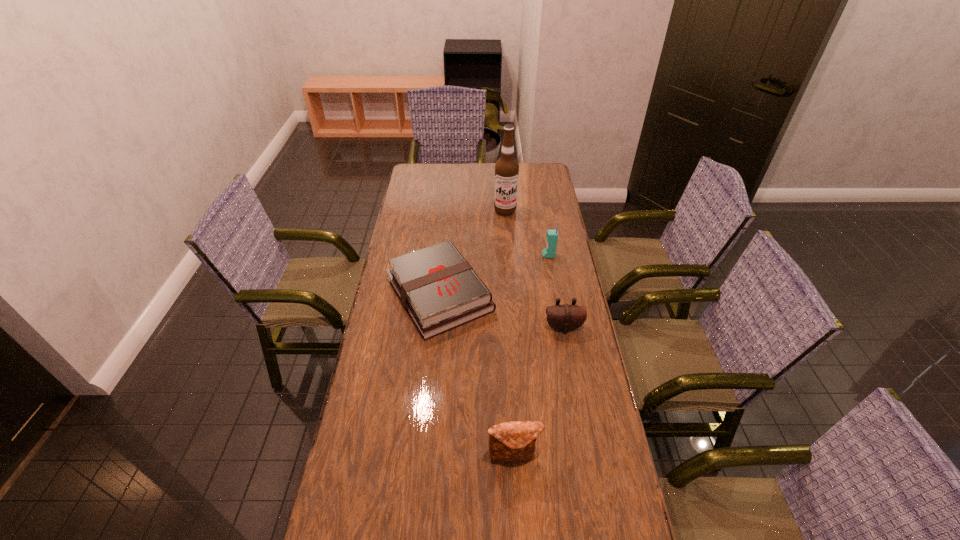
In the image, there is a desktop. Identify the location of blank space at the far right corner. The height and width of the screenshot is (540, 960). [x=548, y=178].

You are a GUI agent. You are given a task and a screenshot of the screen. Output one action in this format:
    pyautogui.click(x=<x>, y=<y>)
    Task: Click on the free space between the pouch and the clutch bag
    This screenshot has width=960, height=540.
    Given the screenshot: What is the action you would take?
    pyautogui.click(x=539, y=392)

Locate an element on the screen. The image size is (960, 540). free space between the cellular telephone and the clutch bag is located at coordinates (531, 356).

At what (x,y) coordinates should I click in order to perform the action: click on empty space that is in between the cellular telephone and the nearest object. Please return your answer as a coordinate pair (x, y). Looking at the image, I should click on (531, 356).

Where is `unoccupied position between the second shortest object and the farthest object`? The height and width of the screenshot is (540, 960). unoccupied position between the second shortest object and the farthest object is located at coordinates (535, 269).

Find the location of a particular element. This screenshot has height=540, width=960. blank region between the shortest object and the nearest object is located at coordinates (476, 375).

Locate an element on the screen. The height and width of the screenshot is (540, 960). free space between the clutch bag and the tallest object is located at coordinates (509, 333).

Image resolution: width=960 pixels, height=540 pixels. I want to click on free space between the clutch bag and the farthest object, so click(x=509, y=333).

The width and height of the screenshot is (960, 540). I want to click on free area in between the nearest object and the second shortest object, so click(x=539, y=392).

Where is `vacant region between the cellular telephone and the nearest object`? Image resolution: width=960 pixels, height=540 pixels. vacant region between the cellular telephone and the nearest object is located at coordinates (531, 356).